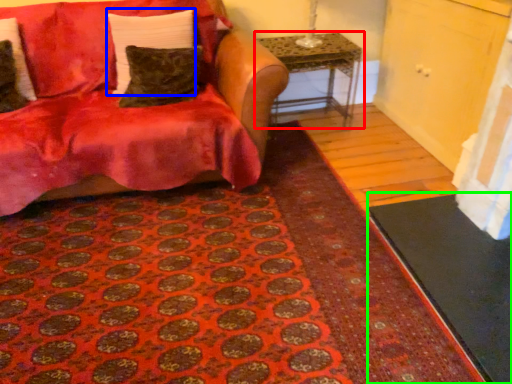
Question: Estimate the real-world distances between objects in this image. Which object is closer to table (highlighted by a red box), pillow (highlighted by a blue box) or doormat (highlighted by a green box)?

Choices:
 (A) pillow
 (B) doormat

Answer: (A)